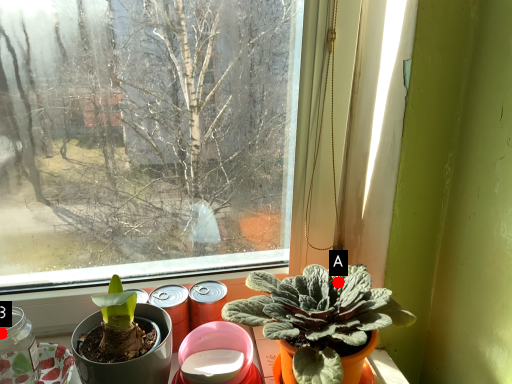
Question: Two points are circled on the image, labeled by A and B beside each circle. Among these points, which one is nearest to the camera?

Choices:
 (A) A is closer
 (B) B is closer

Answer: (A)